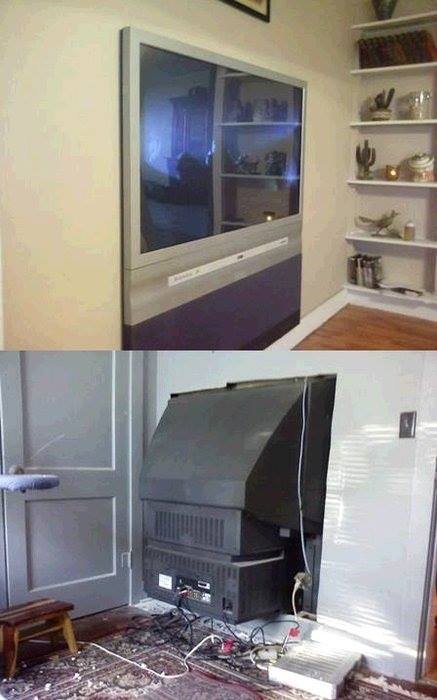
Image resolution: width=437 pixels, height=700 pixels. In order to click on tv front in this screenshot , I will do `click(210, 190)`.